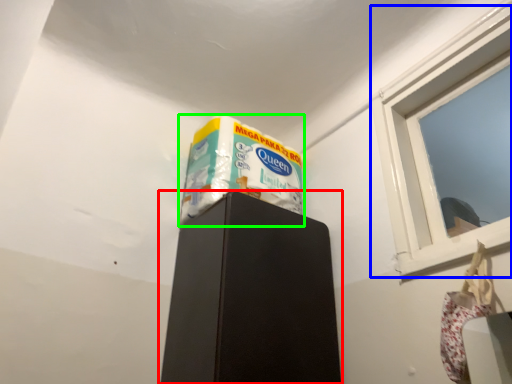
Question: Based on their relative distances, which object is farther from furniture (highlighted by a red box)? Choose from window (highlighted by a blue box) and wrapping paper (highlighted by a green box).

Choices:
 (A) window
 (B) wrapping paper

Answer: (A)